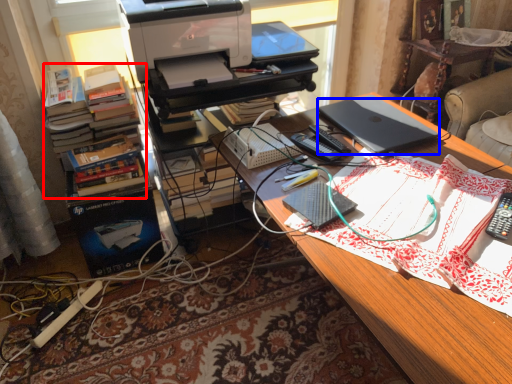
Question: Which object is closer to the camera taking this photo, book (highlighted by a red box) or laptop (highlighted by a blue box)?

Choices:
 (A) book
 (B) laptop

Answer: (B)